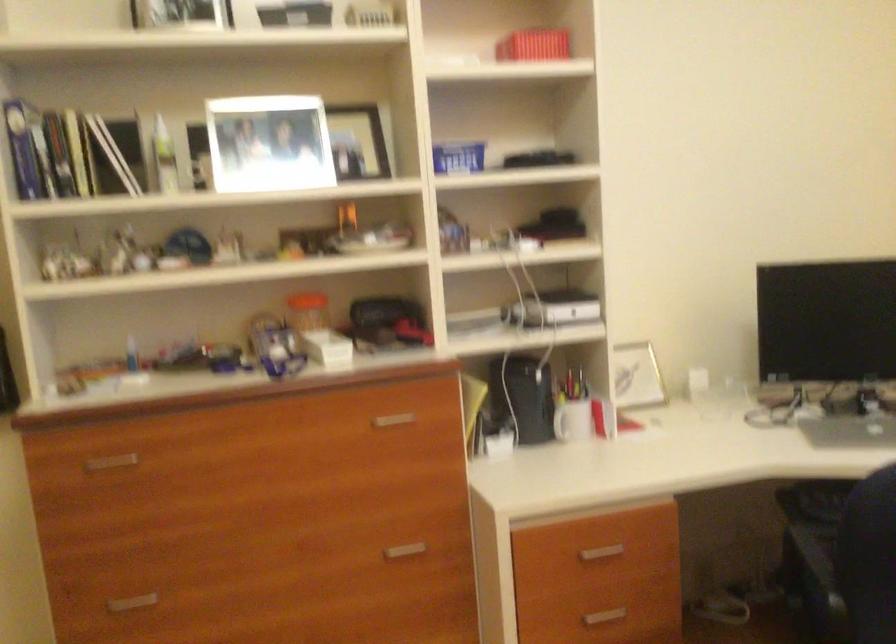
Identify the location of white mug handle. This screenshot has width=896, height=644. (560, 422).